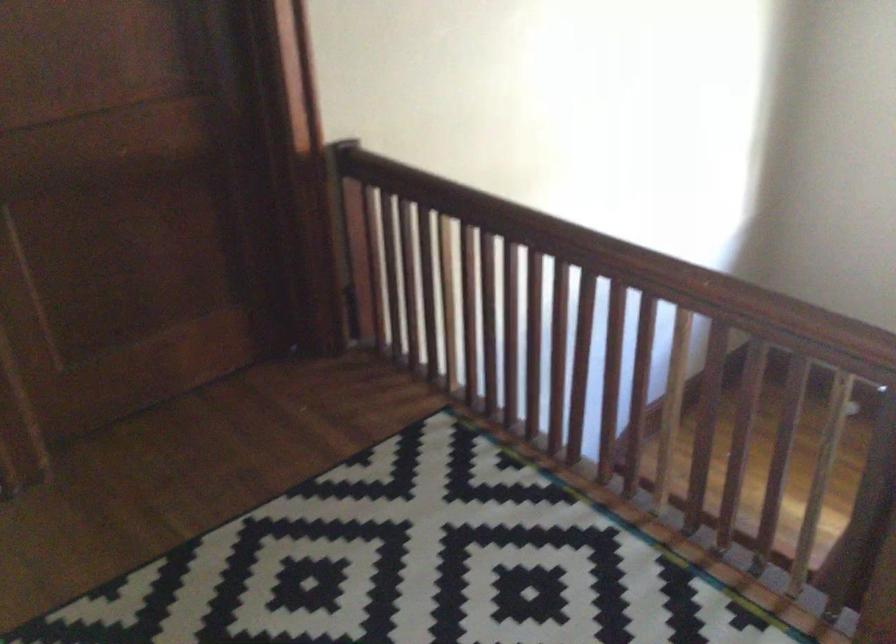
What do you see at coordinates (632, 263) in the screenshot? This screenshot has width=896, height=644. I see `the wooden handrail` at bounding box center [632, 263].